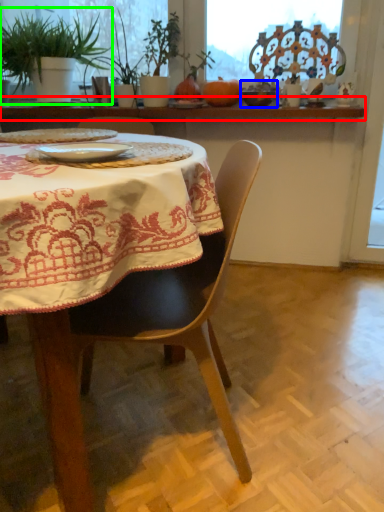
Question: Based on their relative distances, which object is farther from window sill (highlighted by a red box)? Choose from tableware (highlighted by a blue box) and houseplant (highlighted by a green box).

Choices:
 (A) tableware
 (B) houseplant

Answer: (A)